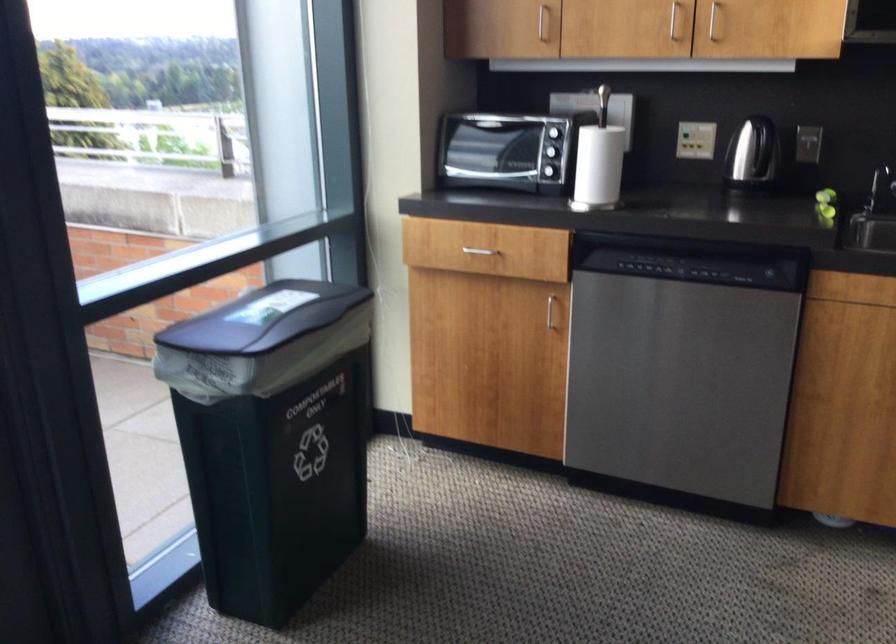
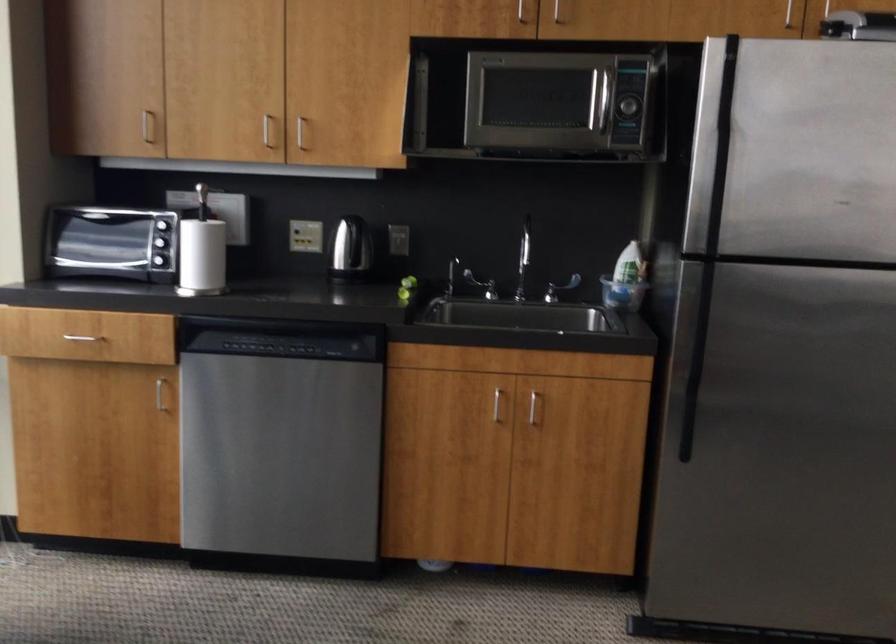
Locate, in the second image, the point that corresponds to [823,187] in the first image.

(409, 281)